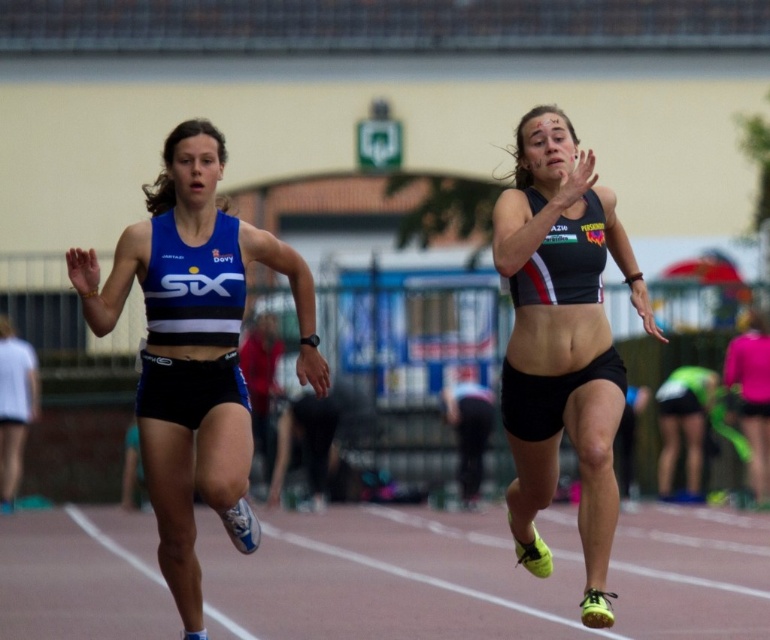
You are a photographer trying to capture a closeup of the blue matte sports bra at left and the black matte sports bra at upper right. Which one would appear larger in your photo?

The blue matte sports bra at left appears larger in the photo because it is closer to the viewer than the black matte sports bra at upper right.

You are a photographer at a track event. You need to position a camera to capture both the blue matte sports bra at left and the black matte sports bra at upper right in the frame. Based on their positions, which athlete should you focus on first to ensure both are in the shot?

The blue matte sports bra at left is taller than the black matte sports bra at upper right, so focusing on the blue matte sports bra at left first will help ensure both are in the frame as it is positioned higher.